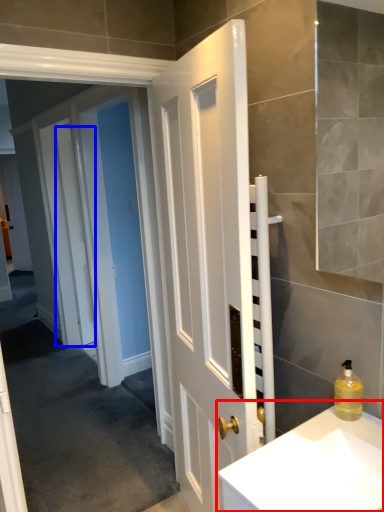
Question: Among these objects, which one is farthest to the camera, sink (highlighted by a red box) or door (highlighted by a blue box)?

Choices:
 (A) sink
 (B) door

Answer: (B)